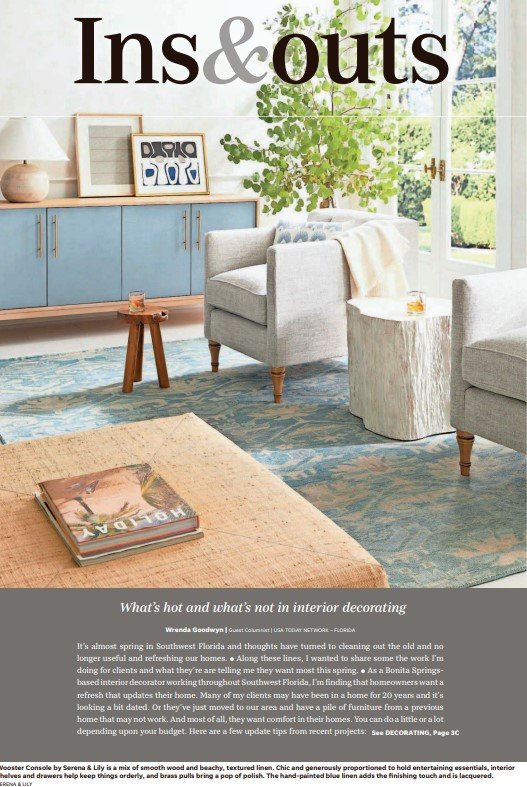
The width and height of the screenshot is (527, 787). In order to click on side tables in this screenshot , I will do `click(386, 311)`, `click(142, 316)`.